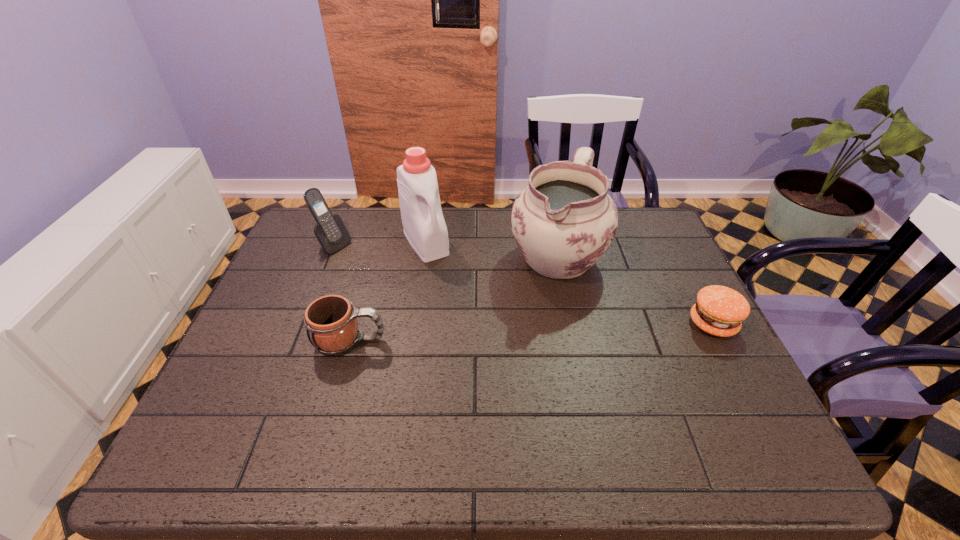
Image resolution: width=960 pixels, height=540 pixels. Find the location of `mug`. mug is located at coordinates (331, 324).

Find the location of `the rightmost object`. the rightmost object is located at coordinates pos(719,310).

At what (x,y) coordinates should I click in order to perform the action: click on the third tallest object. Please return your answer as a coordinate pair (x, y). Looking at the image, I should click on (330, 231).

You are a GUI agent. You are given a task and a screenshot of the screen. Output one action in this format:
    pyautogui.click(x=<x>, y=<y>)
    Task: Click on the second object from right to left
    The image size is (960, 540).
    Given the screenshot: What is the action you would take?
    pyautogui.click(x=563, y=222)

You are a GUI agent. You are given a task and a screenshot of the screen. Output one action in this format:
    pyautogui.click(x=<x>, y=<y>)
    Task: Click on the detergent
    The height and width of the screenshot is (540, 960).
    Given the screenshot: What is the action you would take?
    pyautogui.click(x=424, y=226)

Identify the location of free spot located 0.230m on the side of the mug with the handle. (481, 340).

Locate an element on the screen. The width and height of the screenshot is (960, 540). blank area located 0.180m on the front of the rightmost object is located at coordinates (756, 407).

Identify the location of free space located 0.280m on the front-facing side of the cellular telephone. (412, 290).

Where is `blank space located on the front-facing side of the cellular telephone`? The image size is (960, 540). blank space located on the front-facing side of the cellular telephone is located at coordinates (401, 284).

Find the location of a particular element. blank space located on the front-facing side of the cellular telephone is located at coordinates (444, 309).